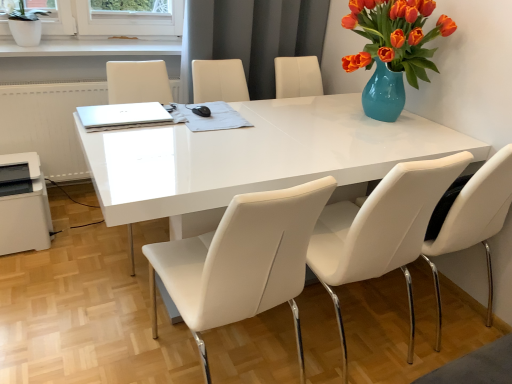
Question: Would you say white ceramic pot at upper left is a long distance from white leather chair at center, positioned as the 3th chair in right-to-left order?

Choices:
 (A) yes
 (B) no

Answer: (A)

Question: Does white ceramic pot at upper left come in front of white leather chair at center, positioned as the 3th chair in right-to-left order?

Choices:
 (A) yes
 (B) no

Answer: (B)

Question: Can you confirm if white ceramic pot at upper left is thinner than white leather chair at center, arranged as the first chair when viewed from the left?

Choices:
 (A) yes
 (B) no

Answer: (A)

Question: Does white ceramic pot at upper left come behind white leather chair at center, arranged as the first chair when viewed from the left?

Choices:
 (A) yes
 (B) no

Answer: (A)

Question: Is white leather chair at center, positioned as the 3th chair in right-to-left order, at the back of white ceramic pot at upper left?

Choices:
 (A) yes
 (B) no

Answer: (B)

Question: Is white leather chair at center, arranged as the first chair when viewed from the left, surrounded by white ceramic pot at upper left?

Choices:
 (A) no
 (B) yes

Answer: (A)

Question: Considering the relative sizes of white plastic printer at lower left and white leather chair at center, positioned as the 3th chair in right-to-left order, in the image provided, is white plastic printer at lower left smaller than white leather chair at center, positioned as the 3th chair in right-to-left order,?

Choices:
 (A) no
 (B) yes

Answer: (B)

Question: From the image's perspective, is white plastic printer at lower left located beneath white leather chair at center, arranged as the first chair when viewed from the left?

Choices:
 (A) yes
 (B) no

Answer: (B)

Question: Is white plastic printer at lower left closer to camera compared to white leather chair at center, arranged as the first chair when viewed from the left?

Choices:
 (A) no
 (B) yes

Answer: (A)

Question: Is white plastic printer at lower left oriented towards white leather chair at center, positioned as the 3th chair in right-to-left order?

Choices:
 (A) no
 (B) yes

Answer: (A)

Question: Is the position of white plastic printer at lower left more distant than that of white leather chair at center, arranged as the first chair when viewed from the left?

Choices:
 (A) yes
 (B) no

Answer: (A)

Question: Considering the relative sizes of white plastic printer at lower left and white leather chair at center, arranged as the first chair when viewed from the left, in the image provided, is white plastic printer at lower left bigger than white leather chair at center, arranged as the first chair when viewed from the left,?

Choices:
 (A) no
 (B) yes

Answer: (A)

Question: Is white leather chair at center, placed as the 2th chair when sorted from right to left, far away from white plastic printer at lower left?

Choices:
 (A) no
 (B) yes

Answer: (B)